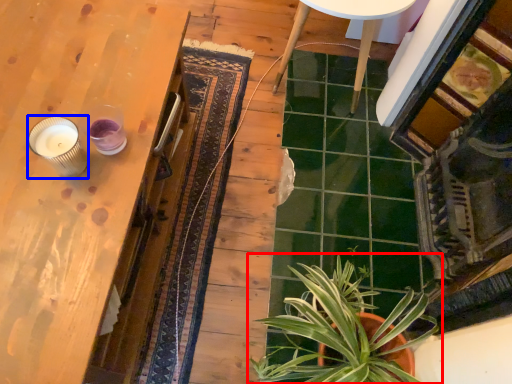
Question: Which point is closer to the camera, houseplant (highlighted by a red box) or candle holder (highlighted by a blue box)?

Choices:
 (A) houseplant
 (B) candle holder

Answer: (B)